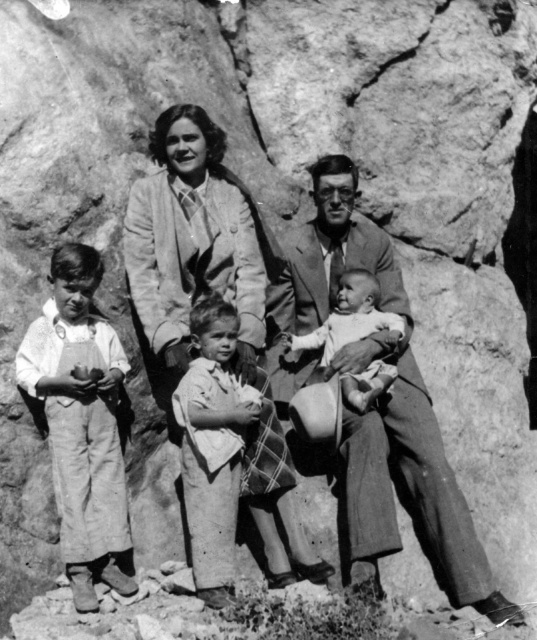
You are a photographer trying to adjust the lighting for a family portrait. You notice the white cotton shirt at left and the smooth skin baby at center. Which object requires more light to ensure proper exposure, considering their size and reflectivity?

The white cotton shirt at left requires more light because it is larger in size and white surfaces typically reflect more light than the smooth skin baby at center, which has lower reflectivity.

You are a photographer who needs to adjust the lighting to ensure both the white cotton shirt at left and the smooth skin baby at center are well lit. Based on their positions, which object should you focus on first to ensure proper exposure?

The white cotton shirt at left is in front of the smooth skin baby at center, so you should focus on adjusting the lighting for the white cotton shirt at left first to ensure it doesn not become overexposed while also considering the baby behind it.